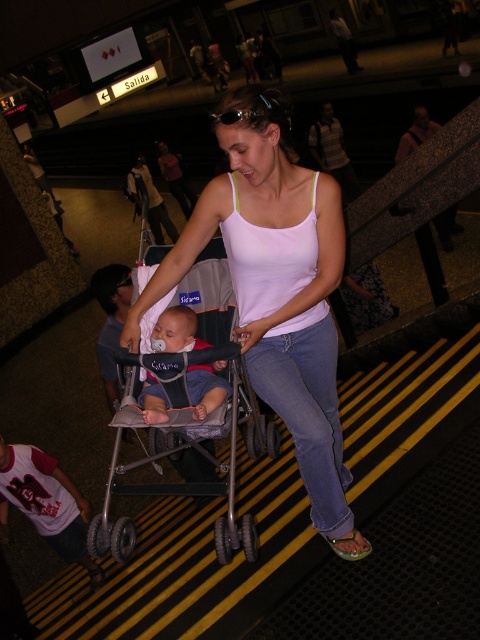
Question: Can you confirm if gray fabric stroller at center is wider than white cotton shirt at lower left?

Choices:
 (A) no
 (B) yes

Answer: (B)

Question: Is blue denim jeans at center below soft blue fabric baby at center?

Choices:
 (A) yes
 (B) no

Answer: (A)

Question: Does white cotton shirt at lower left appear on the left side of soft blue fabric baby at center?

Choices:
 (A) yes
 (B) no

Answer: (A)

Question: Based on their relative distances, which object is farther from the soft blue fabric baby at center?

Choices:
 (A) gray fabric stroller at center
 (B) blue denim jeans at center

Answer: (B)

Question: Which point appears closest to the camera in this image?

Choices:
 (A) (173, 314)
 (B) (226, 321)

Answer: (A)

Question: Among these objects, which one is farthest from the camera?

Choices:
 (A) blue denim jeans at center
 (B) gray fabric stroller at center

Answer: (B)